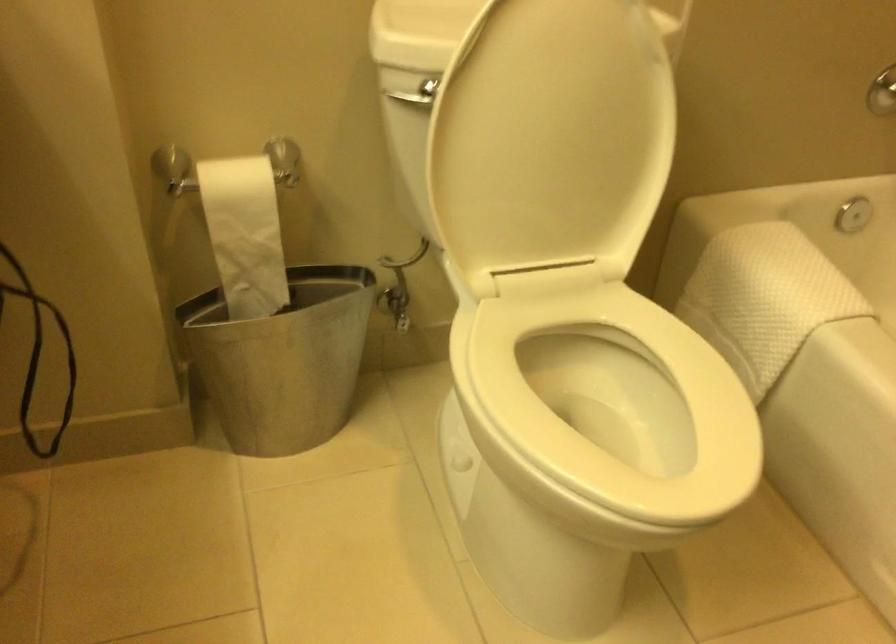
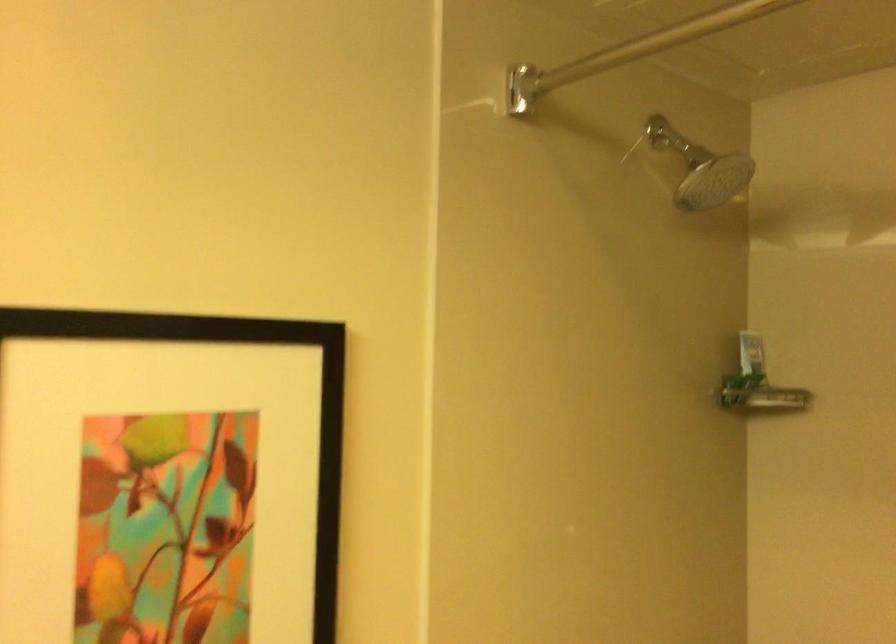
From the picture: The images are taken continuously from a first-person perspective. In which direction is your viewpoint rotating?

The camera's rotation is toward right-up.